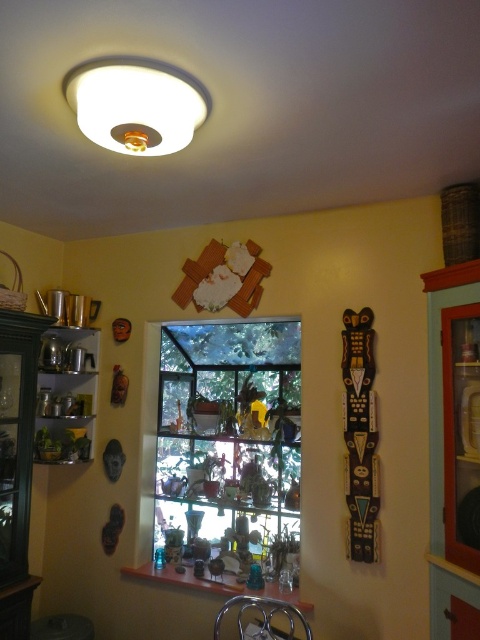
You are trying to hang a large painting that is 1.5 meters tall. You have two options to place it in the room described in the scene. One is above the clear glass window at center, and the other is above the metallic shiny pots at left. Based on their sizes, which location would be more suitable for the painting?

The clear glass window at center is much taller than the metallic shiny pots at left, so placing the large painting above the clear glass window at center would be more suitable as it provides enough vertical space.

You are planning to hang a new painting that is 1.2 meters wide. You want to place it in the room where the clear glass window at center and the white matte light fixture at upper center are located. Which object do you think the painting would fit better next to, considering their sizes?

The clear glass window at center is larger in size than the white matte light fixture at upper center, so the painting would fit better next to the clear glass window at center since it has more space available.